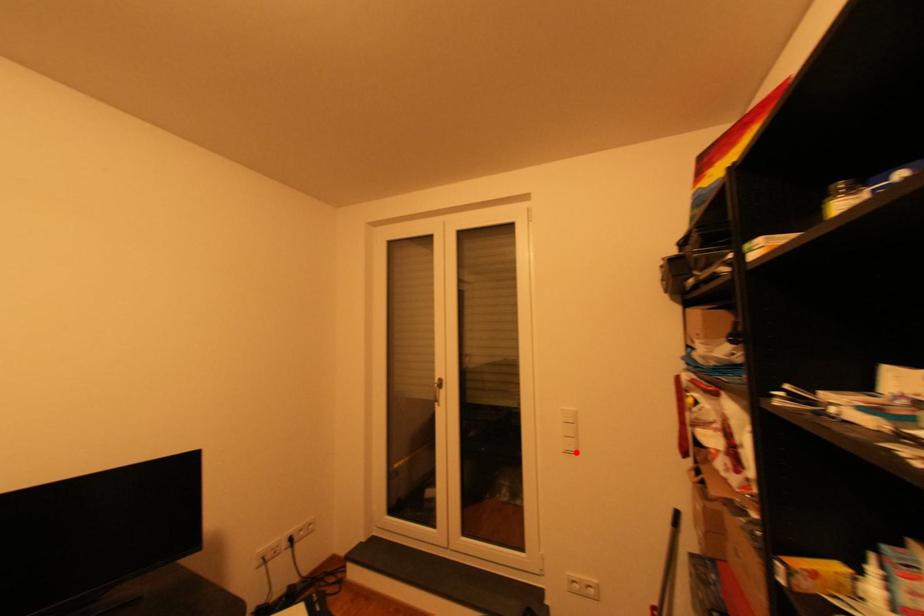
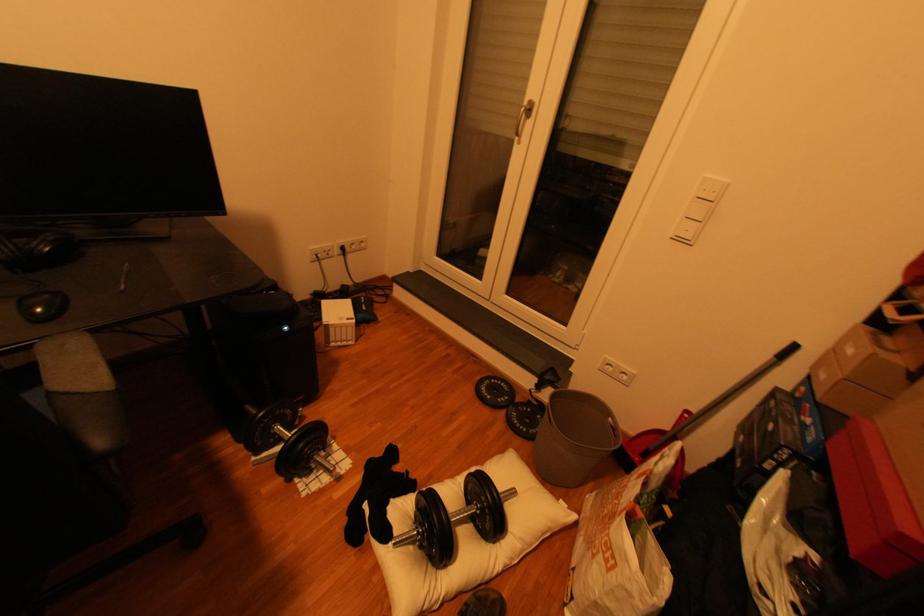
Find the pixel in the second image that matches the highlighted location in the first image.

(687, 240)